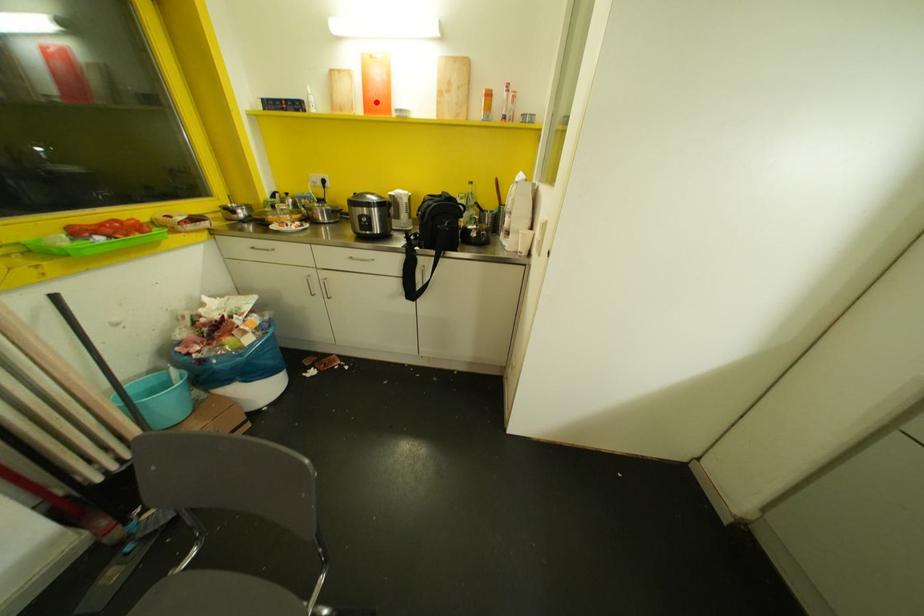
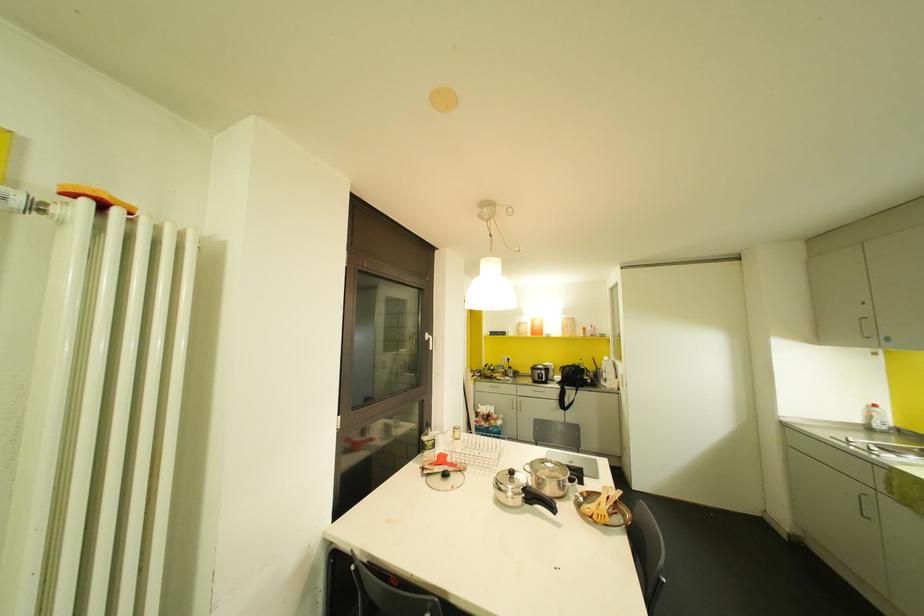
Find the pixel in the second image that matches the highlighted location in the first image.

(536, 331)